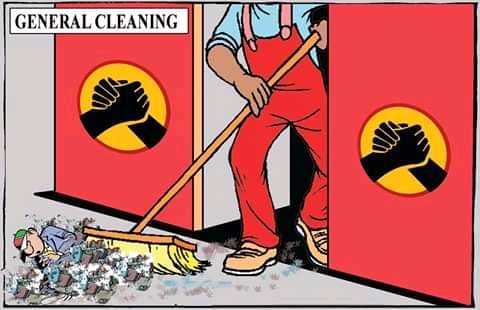
What are the coordinates of `broom` in the screenshot? It's located at (141, 246), (145, 222), (163, 207), (180, 180).